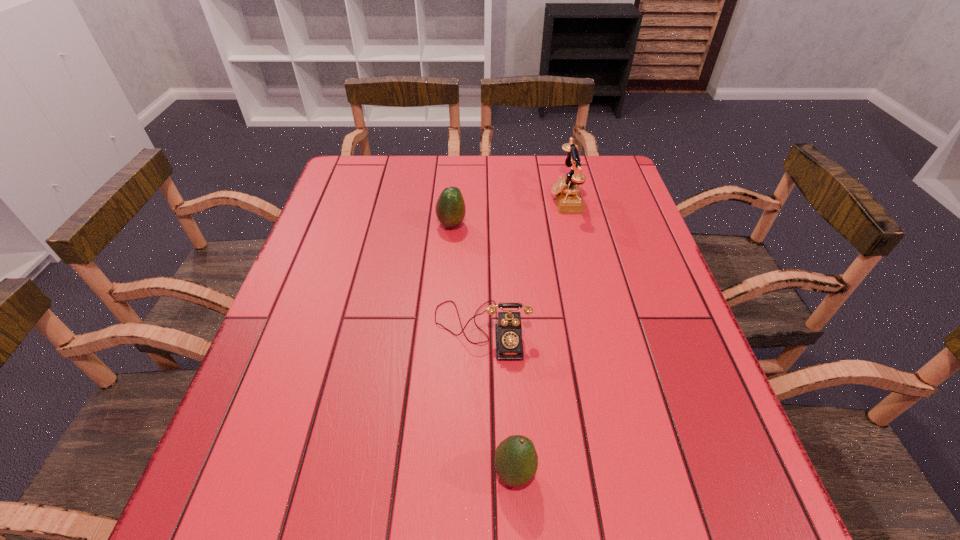
Locate an element on the screen. free space at the near left corner of the desktop is located at coordinates (287, 531).

In the image, there is a desktop. Find the location of `vacant space at the far right corner`. vacant space at the far right corner is located at coordinates (599, 180).

This screenshot has width=960, height=540. Identify the location of free space between the nearer avocado and the left telephone. (498, 401).

The width and height of the screenshot is (960, 540). Identify the location of free space between the farther avocado and the right telephone. (509, 212).

At what (x,y) coordinates should I click in order to perform the action: click on vacant area between the taller telephone and the shorter telephone. Please return your answer as a coordinate pair (x, y). The image size is (960, 540). Looking at the image, I should click on (523, 264).

The width and height of the screenshot is (960, 540). What are the coordinates of `free space that is in between the nearest object and the rightmost object` in the screenshot? It's located at (540, 335).

What are the coordinates of `free space between the rightmost object and the left avocado` in the screenshot? It's located at (509, 212).

Locate an element on the screen. The image size is (960, 540). free spot between the left avocado and the farther telephone is located at coordinates (509, 212).

This screenshot has height=540, width=960. In order to click on vacant point located between the farther avocado and the rightmost object in this screenshot , I will do `click(509, 212)`.

I want to click on vacant area that lies between the farther avocado and the taller telephone, so 509,212.